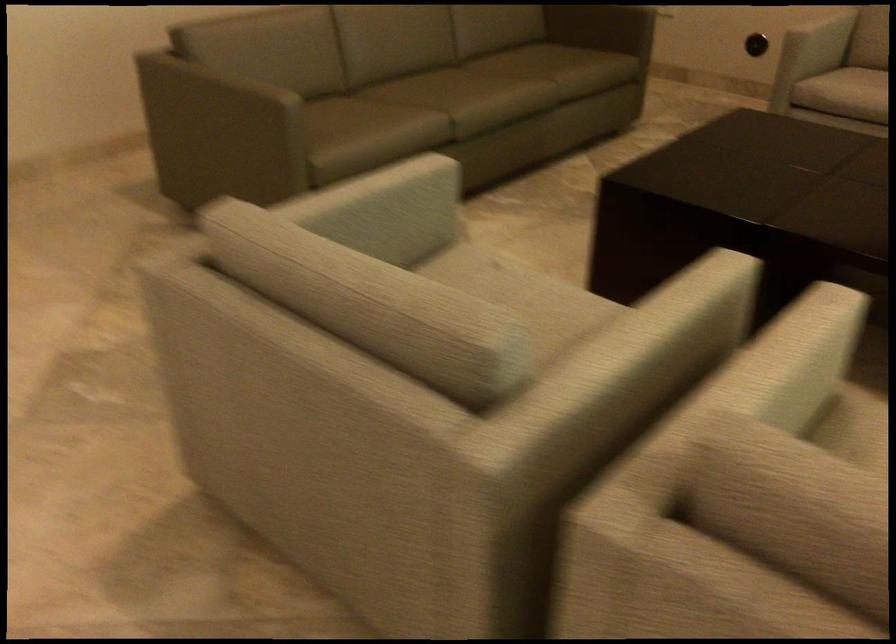
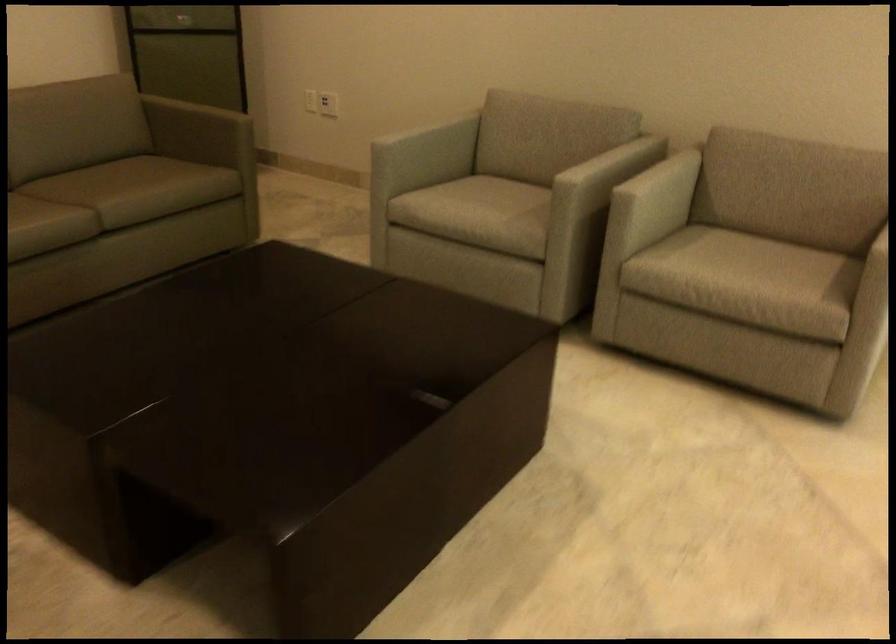
In the second image, find the point that corresponds to pixel 588 67 in the first image.

(145, 187)